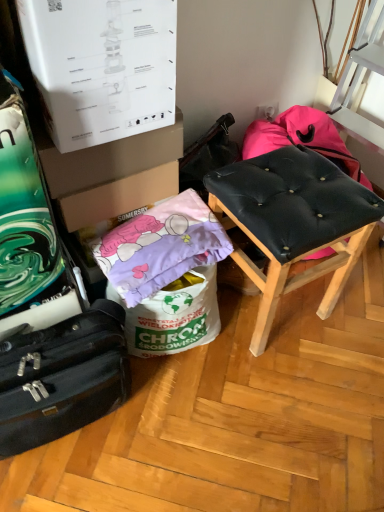
Question: Does point (304, 148) appear closer or farther from the camera than point (66, 226)?

Choices:
 (A) closer
 (B) farther

Answer: (B)

Question: Considering their positions, is black leather stool at right located in front of or behind brown cardboard box at center, marked as the 2th cardboard box in a top-to-bottom arrangement?

Choices:
 (A) front
 (B) behind

Answer: (A)

Question: Which object is the farthest from the purple fabric pillow at lower left?

Choices:
 (A) brown cardboard box at upper left, which is counted as the first cardboard box, starting from the top
 (B) black fabric suitcase at lower left
 (C) brown cardboard box at center, the 1th cardboard box positioned from the bottom
 (D) black leather stool at right

Answer: (B)

Question: Based on their relative distances, which object is nearer to the brown cardboard box at center, marked as the 2th cardboard box in a top-to-bottom arrangement?

Choices:
 (A) black leather stool at right
 (B) brown cardboard box at upper left, which is counted as the first cardboard box, starting from the top
 (C) purple fabric pillow at lower left
 (D) black fabric suitcase at lower left

Answer: (B)